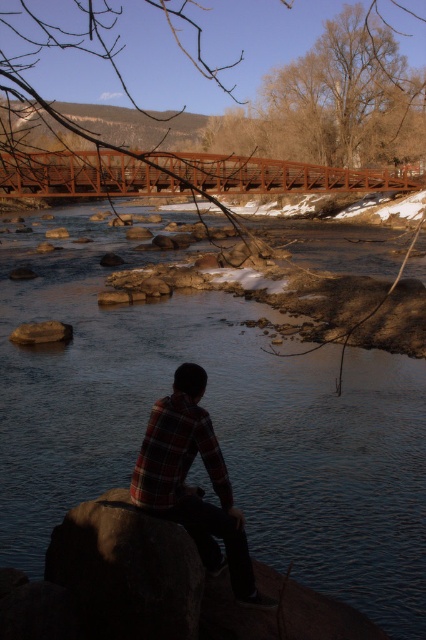
Does clear water at center appear under dark gray stone boulder at center?

Incorrect, clear water at center is not positioned below dark gray stone boulder at center.

Between clear water at center and dark gray stone boulder at center, which one is positioned higher?

clear water at center is above.

I want to click on clear water at center, so click(x=213, y=422).

In order to click on clear water at center in this screenshot , I will do `click(213, 422)`.

Does dark gray stone boulder at center have a smaller size compared to plaid fabric shirt at center?

Yes.

Does point (150, 540) lie in front of point (213, 476)?

Yes, it is in front of point (213, 476).

Where is `dark gray stone boulder at center`? Image resolution: width=426 pixels, height=640 pixels. dark gray stone boulder at center is located at coordinates (126, 570).

Locate an element on the screen. dark gray stone boulder at center is located at coordinates (126, 570).

Does clear water at center appear over brown smooth rock at lower center?

Correct, clear water at center is located above brown smooth rock at lower center.

In the scene shown: Is clear water at center to the right of brown smooth rock at lower center from the viewer's perspective?

Yes, clear water at center is to the right of brown smooth rock at lower center.

Identify the location of clear water at center. The image size is (426, 640). (213, 422).

Locate an element on the screen. clear water at center is located at coordinates (213, 422).